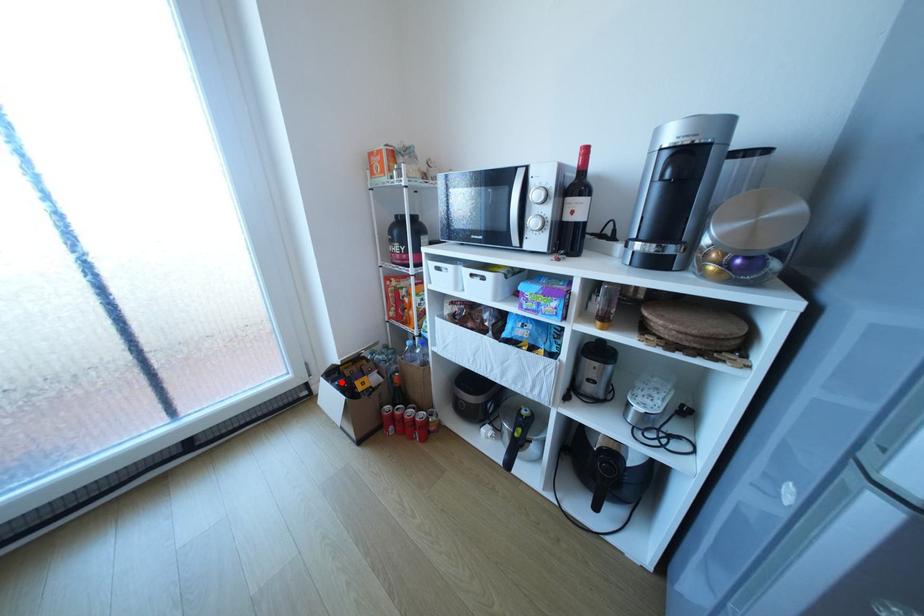
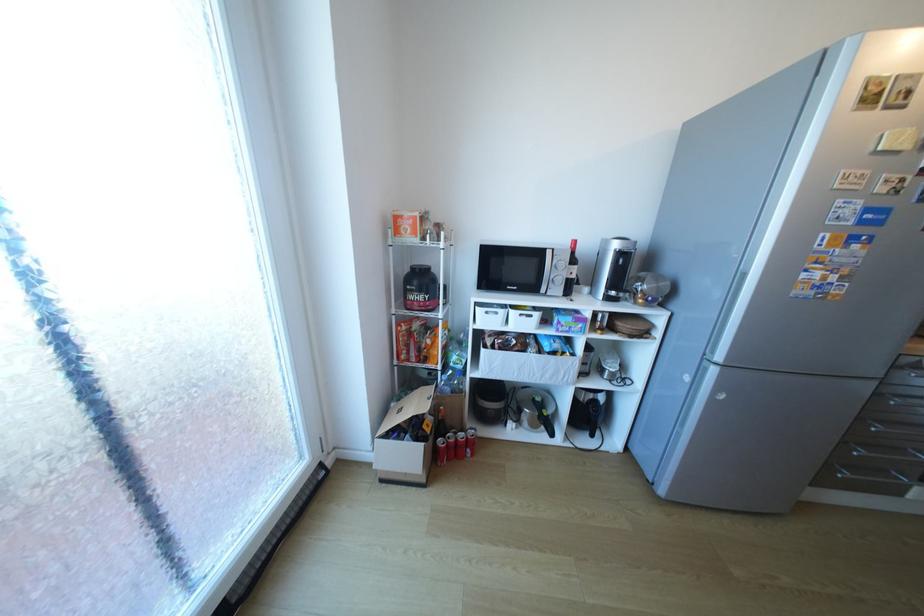
Question: A red point is marked in image1. In image2, is the corresponding 3D point closer to the camera or farther? Reply with the corresponding letter.

Choices:
 (A) The corresponding 3D point is closer.
 (B) The corresponding 3D point is farther.

Answer: (B)